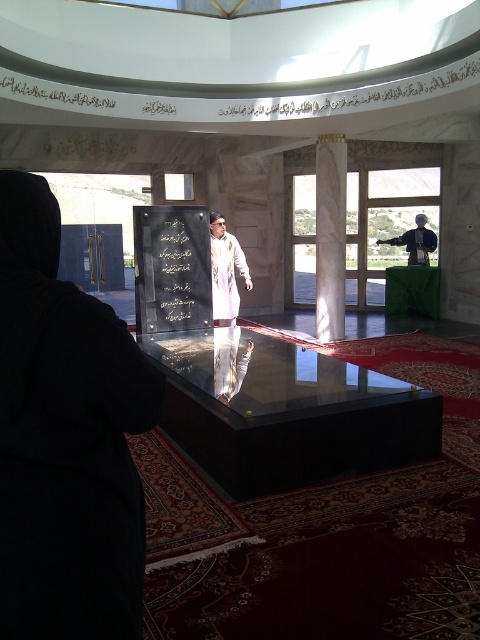
Question: Which object appears farthest from the camera in this image?

Choices:
 (A) white marble column at center
 (B) black matte dress at left
 (C) white matte robe at center

Answer: (A)

Question: Which object is positioned closest to the black matte dress at left?

Choices:
 (A) white matte robe at center
 (B) black polished stone at center
 (C) white marble column at center

Answer: (B)

Question: Can you confirm if white marble column at center is thinner than dark gray fabric robe at right?

Choices:
 (A) yes
 (B) no

Answer: (A)

Question: Which point appears closest to the camera in this image?

Choices:
 (A) (417, 230)
 (B) (155, 241)
 (C) (181, 280)

Answer: (B)

Question: In this image, where is black matte dress at left located relative to black polished stone plaque at center?

Choices:
 (A) below
 (B) above

Answer: (A)

Question: Can you confirm if white marble column at center is positioned above dark gray fabric robe at right?

Choices:
 (A) no
 (B) yes

Answer: (A)